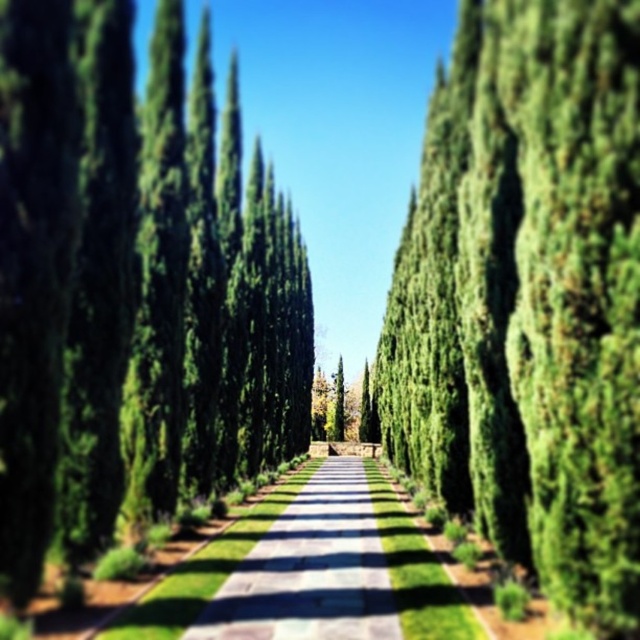
Between green leafy tree at center and green glossy trees at center, which one is positioned higher?

Positioned higher is green glossy trees at center.

Who is positioned more to the right, green leafy tree at center or green glossy trees at center?

green leafy tree at center is more to the right.

The image size is (640, 640). What are the coordinates of `green leafy tree at center` in the screenshot? It's located at (532, 301).

Is green leafy tree at center positioned before green concrete path at center?

Yes, it is in front of green concrete path at center.

Can you confirm if green leafy tree at center is smaller than green concrete path at center?

Incorrect, green leafy tree at center is not smaller in size than green concrete path at center.

This screenshot has width=640, height=640. Find the location of `green leafy tree at center`. green leafy tree at center is located at coordinates (532, 301).

Find the location of a particular element. green leafy tree at center is located at coordinates (532, 301).

Can you confirm if green glossy trees at center is thinner than green concrete path at center?

Correct, green glossy trees at center's width is less than green concrete path at center's.

Who is more forward, (28, 330) or (349, 483)?

Positioned in front is point (28, 330).

I want to click on green glossy trees at center, so click(x=93, y=284).